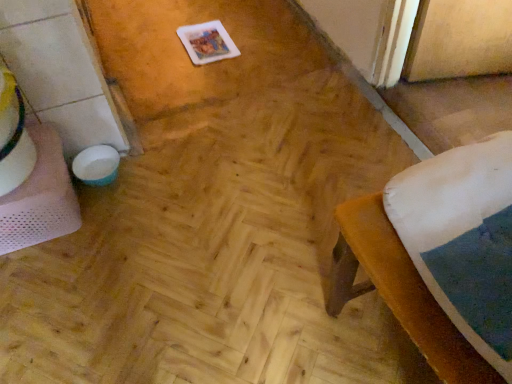
Where is `vacant space in between brown fabric stool at lower right and white mesh table at left`? vacant space in between brown fabric stool at lower right and white mesh table at left is located at coordinates (195, 264).